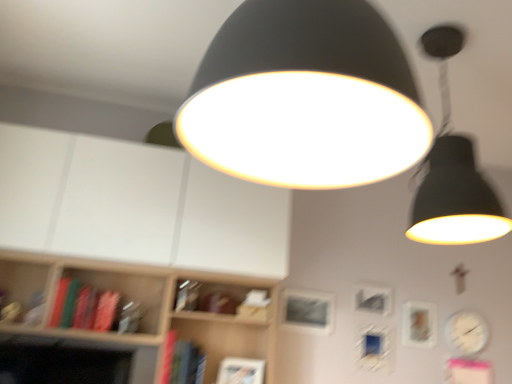
Describe the element at coordinates (307, 311) in the screenshot. I see `metallic silver picture frame at center, arranged as the 1th picture frame when viewed from the left` at that location.

This screenshot has width=512, height=384. Describe the element at coordinates (59, 301) in the screenshot. I see `green matte book at left, arranged as the 2th book when ordered from the bottom` at that location.

Measure the distance between point (x=424, y=311) and camera.

Point (x=424, y=311) is 8.96 feet away from camera.

This screenshot has height=384, width=512. I want to click on metallic silver picture frame at center, which is counted as the 2th picture frame, starting from the right, so click(373, 298).

Describe the element at coordinates (373, 298) in the screenshot. I see `metallic silver picture frame at center, which is counted as the 2th picture frame, starting from the right` at that location.

Locate an element on the screen. hardcover book at lower center, which appears as the first book when viewed from the right is located at coordinates pyautogui.click(x=182, y=362).

From the image's perspective, is metallic silver picture frame at center, which is counted as the 2th picture frame, starting from the left, located beneath white glossy clock at lower right?

Actually, metallic silver picture frame at center, which is counted as the 2th picture frame, starting from the left, appears above white glossy clock at lower right in the image.

Considering the positions of point (377, 288) and point (476, 322), is point (377, 288) closer or farther from the camera than point (476, 322)?

Point (377, 288) is positioned closer to the camera compared to point (476, 322).

From a real-world perspective, is metallic silver picture frame at center, which is counted as the 2th picture frame, starting from the right, physically located above or below white glossy clock at lower right?

metallic silver picture frame at center, which is counted as the 2th picture frame, starting from the right, is above white glossy clock at lower right.

Considering the relative sizes of metallic silver picture frame at center, which is counted as the 2th picture frame, starting from the left, and white glossy clock at lower right in the image provided, is metallic silver picture frame at center, which is counted as the 2th picture frame, starting from the left, wider than white glossy clock at lower right?

Incorrect, the width of metallic silver picture frame at center, which is counted as the 2th picture frame, starting from the left, does not surpass that of white glossy clock at lower right.

From a real-world perspective, is hardcover book at lower center, which appears as the first book when viewed from the right, physically below green matte book at left, positioned as the first book in left-to-right order?

Indeed, from a real-world perspective, hardcover book at lower center, which appears as the first book when viewed from the right, is positioned beneath green matte book at left, positioned as the first book in left-to-right order.

From the image's perspective, is hardcover book at lower center, positioned as the second book in top-to-bottom order, below green matte book at left, positioned as the first book in left-to-right order?

Indeed, from the image's perspective, hardcover book at lower center, positioned as the second book in top-to-bottom order, is shown beneath green matte book at left, positioned as the first book in left-to-right order.

Could you tell me if hardcover book at lower center, the 1th book in the bottom-to-top sequence, is facing green matte book at left, arranged as the 2th book when ordered from the bottom?

No, hardcover book at lower center, the 1th book in the bottom-to-top sequence, is not oriented towards green matte book at left, arranged as the 2th book when ordered from the bottom.

Which object is further away from the camera taking this photo, hardcover book at lower center, which appears as the first book when viewed from the right, or green matte book at left, which is the first book from top to bottom?

green matte book at left, which is the first book from top to bottom.

Is there a large distance between matte black lampshade at center, which is the 1th lamp in front-to-back order, and hardcover book at lower center, positioned as the second book in top-to-bottom order?

Yes, matte black lampshade at center, which is the 1th lamp in front-to-back order, and hardcover book at lower center, positioned as the second book in top-to-bottom order, are located far from each other.

Is matte black lampshade at center, the 1th lamp viewed from the left, facing away from hardcover book at lower center, positioned as the second book in top-to-bottom order?

Yes, matte black lampshade at center, the 1th lamp viewed from the left, is positioned with its back facing hardcover book at lower center, positioned as the second book in top-to-bottom order.

Can you confirm if matte black lampshade at center, the 2th lamp viewed from the right, is wider than hardcover book at lower center, the 1th book in the bottom-to-top sequence?

Yes, matte black lampshade at center, the 2th lamp viewed from the right, is wider than hardcover book at lower center, the 1th book in the bottom-to-top sequence.

Which book is the 1st one when counting from the left side of the matte black lampshade at center, the 2th lamp viewed from the right? Please provide its 2D coordinates.

[(182, 362)]

Between matte black lampshade at upper right, arranged as the first lamp when viewed from the back, and matte silver picture frame at right, which is the third picture frame from left to right, which one has smaller size?

matte silver picture frame at right, which is the third picture frame from left to right, is smaller.

Is matte black lampshade at upper right, arranged as the first lamp when viewed from the right, turned away from matte silver picture frame at right, positioned as the first picture frame in right-to-left order?

No, matte black lampshade at upper right, arranged as the first lamp when viewed from the right, is not facing away from matte silver picture frame at right, positioned as the first picture frame in right-to-left order.

What's the angular difference between matte black lampshade at upper right, acting as the second lamp starting from the left, and matte silver picture frame at right, positioned as the first picture frame in right-to-left order,'s facing directions?

The angular difference between matte black lampshade at upper right, acting as the second lamp starting from the left, and matte silver picture frame at right, positioned as the first picture frame in right-to-left order, is 1.99 degrees.

Which object is positioned more to the left, matte black lampshade at upper right, arranged as the first lamp when viewed from the right, or matte silver picture frame at right, positioned as the first picture frame in right-to-left order?

matte black lampshade at upper right, arranged as the first lamp when viewed from the right, is more to the left.

Choose the correct answer: Is metallic silver picture frame at center, which is counted as the 2th picture frame, starting from the right, inside hardcover book at lower center, positioned as the second book in top-to-bottom order, or outside it?

metallic silver picture frame at center, which is counted as the 2th picture frame, starting from the right, cannot be found inside hardcover book at lower center, positioned as the second book in top-to-bottom order.

Looking at this image, is the position of metallic silver picture frame at center, which is counted as the 2th picture frame, starting from the left, less distant than that of hardcover book at lower center, the 1th book in the bottom-to-top sequence?

No, metallic silver picture frame at center, which is counted as the 2th picture frame, starting from the left, is behind hardcover book at lower center, the 1th book in the bottom-to-top sequence.

How far apart are metallic silver picture frame at center, which is counted as the 2th picture frame, starting from the right, and hardcover book at lower center, which appears as the first book when viewed from the right?

metallic silver picture frame at center, which is counted as the 2th picture frame, starting from the right, is 1.12 meters away from hardcover book at lower center, which appears as the first book when viewed from the right.

Can you confirm if metallic silver picture frame at center, which is counted as the 2th picture frame, starting from the right, is bigger than hardcover book at lower center, which is the 2th book from left to right?

Actually, metallic silver picture frame at center, which is counted as the 2th picture frame, starting from the right, might be smaller than hardcover book at lower center, which is the 2th book from left to right.

Is green matte book at left, positioned as the first book in left-to-right order, wider than matte black lampshade at upper right, acting as the second lamp starting from the left?

In fact, green matte book at left, positioned as the first book in left-to-right order, might be narrower than matte black lampshade at upper right, acting as the second lamp starting from the left.

Is green matte book at left, which is the first book from top to bottom, taller than matte black lampshade at upper right, arranged as the first lamp when viewed from the back?

No, green matte book at left, which is the first book from top to bottom, is not taller than matte black lampshade at upper right, arranged as the first lamp when viewed from the back.

Is green matte book at left, positioned as the first book in left-to-right order, to the left of matte black lampshade at upper right, acting as the second lamp starting from the left, from the viewer's perspective?

Correct, you'll find green matte book at left, positioned as the first book in left-to-right order, to the left of matte black lampshade at upper right, acting as the second lamp starting from the left.

Is matte black lampshade at upper right, arranged as the first lamp when viewed from the back, at the back of green matte book at left, positioned as the first book in left-to-right order?

Answer: No.

Measure the distance between white glossy clock at lower right and matte silver picture frame at right, positioned as the first picture frame in right-to-left order.

white glossy clock at lower right is 7.98 inches away from matte silver picture frame at right, positioned as the first picture frame in right-to-left order.

Which is more to the left, white glossy clock at lower right or matte silver picture frame at right, positioned as the first picture frame in right-to-left order?

From the viewer's perspective, matte silver picture frame at right, positioned as the first picture frame in right-to-left order, appears more on the left side.

Is white glossy clock at lower right next to matte silver picture frame at right, which is the third picture frame from left to right?

white glossy clock at lower right is not next to matte silver picture frame at right, which is the third picture frame from left to right, and they're not touching.

From a real-world perspective, is white glossy clock at lower right over matte silver picture frame at right, which is the third picture frame from left to right?

Answer: No, from a real-world perspective, white glossy clock at lower right is not above matte silver picture frame at right, which is the third picture frame from left to right.

Where is `clock that appears below the metallic silver picture frame at center, which is counted as the 2th picture frame, starting from the left (from a real-world perspective)`? clock that appears below the metallic silver picture frame at center, which is counted as the 2th picture frame, starting from the left (from a real-world perspective) is located at coordinates (466, 332).

I want to click on book below the green matte book at left, which ranks as the 2th book in right-to-left order (from the image's perspective), so click(x=182, y=362).

When comparing their distances from white glossy clock at lower right, does metallic silver picture frame at center, which is counted as the 2th picture frame, starting from the right, or matte black lampshade at center, the 1th lamp viewed from the left, seem further?

The object further to white glossy clock at lower right is matte black lampshade at center, the 1th lamp viewed from the left.

Which object lies further to the anchor point matte silver picture frame at right, which is the third picture frame from left to right, white glossy clock at lower right or matte black lampshade at upper right, arranged as the first lamp when viewed from the right?

matte black lampshade at upper right, arranged as the first lamp when viewed from the right.

Looking at the image, which one is located closer to hardcover book at lower center, the 1th book in the bottom-to-top sequence, metallic silver picture frame at center, arranged as the 1th picture frame when viewed from the left, or matte black lampshade at upper right, arranged as the first lamp when viewed from the right?

metallic silver picture frame at center, arranged as the 1th picture frame when viewed from the left.

From the image, which object appears to be farther from matte silver picture frame at right, positioned as the first picture frame in right-to-left order, hardcover book at lower center, the 1th book in the bottom-to-top sequence, or metallic silver picture frame at center, which is counted as the 2th picture frame, starting from the left?

Based on the image, hardcover book at lower center, the 1th book in the bottom-to-top sequence, appears to be further to matte silver picture frame at right, positioned as the first picture frame in right-to-left order.

From the image, which object appears to be nearer to matte silver picture frame at right, which is the third picture frame from left to right, matte black lampshade at upper right, arranged as the first lamp when viewed from the right, or white glossy clock at lower right?

The object closer to matte silver picture frame at right, which is the third picture frame from left to right, is white glossy clock at lower right.

Based on their spatial positions, is matte black lampshade at upper right, placed as the 2th lamp when sorted from front to back, or metallic silver picture frame at center, which is counted as the 2th picture frame, starting from the right, further from matte silver picture frame at right, which is the third picture frame from left to right?

matte black lampshade at upper right, placed as the 2th lamp when sorted from front to back.

When comparing their distances from white glossy clock at lower right, does matte black lampshade at center, the 1th lamp viewed from the left, or matte silver picture frame at right, which is the third picture frame from left to right, seem closer?

matte silver picture frame at right, which is the third picture frame from left to right.

Consider the image. From the image, which object appears to be farther from white glossy clock at lower right, matte black lampshade at upper right, arranged as the first lamp when viewed from the right, or matte silver picture frame at right, which is the third picture frame from left to right?

matte black lampshade at upper right, arranged as the first lamp when viewed from the right, lies further to white glossy clock at lower right than the other object.

Locate an element on the screen. picture frame between matte black lampshade at upper right, arranged as the first lamp when viewed from the back, and metallic silver picture frame at center, which is counted as the 2th picture frame, starting from the left, in the front-back direction is located at coordinates (307, 311).

Locate an element on the screen. The image size is (512, 384). book located between green matte book at left, which ranks as the 2th book in right-to-left order, and metallic silver picture frame at center, which is counted as the 2th picture frame, starting from the left, in the left-right direction is located at coordinates (182, 362).

Find the location of a particular element. book between green matte book at left, which ranks as the 2th book in right-to-left order, and matte silver picture frame at right, which is the third picture frame from left to right, from left to right is located at coordinates (182, 362).

Identify the location of lamp between matte black lampshade at center, the 1th lamp viewed from the left, and hardcover book at lower center, positioned as the second book in top-to-bottom order, in the front-back direction. (452, 171).